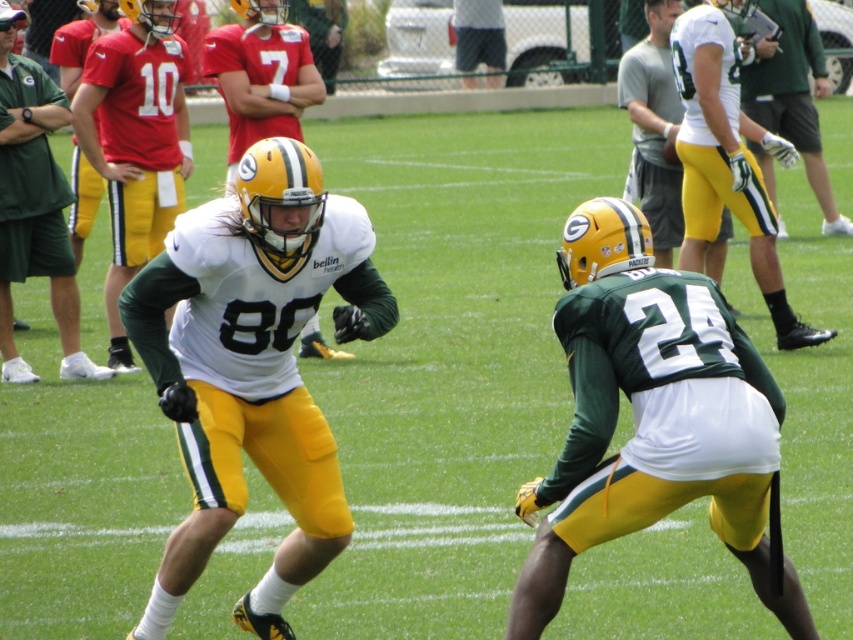
Can you confirm if matte green helmet at left is positioned to the left of green matte helmet at upper right?

Yes, matte green helmet at left is to the left of green matte helmet at upper right.

Consider the image. Which is more to the right, matte green helmet at left or green matte helmet at upper right?

From the viewer's perspective, green matte helmet at upper right appears more on the right side.

Identify the location of matte green helmet at left. The width and height of the screenshot is (853, 640). (33, 205).

Where is `matte green helmet at left`? matte green helmet at left is located at coordinates (33, 205).

Is green matte jersey at center below matte green helmet at left?

Indeed, green matte jersey at center is positioned under matte green helmet at left.

Between green matte jersey at center and matte green helmet at left, which one has less height?

With less height is green matte jersey at center.

You are a GUI agent. You are given a task and a screenshot of the screen. Output one action in this format:
    pyautogui.click(x=<x>, y=<y>)
    Task: Click on the green matte jersey at center
    This screenshot has height=640, width=853.
    Given the screenshot: What is the action you would take?
    pyautogui.click(x=653, y=417)

Who is positioned more to the left, green matte jersey at center or green matte helmet at upper right?

Positioned to the left is green matte jersey at center.

Looking at this image, is green matte jersey at center wider than green matte helmet at upper right?

No, green matte jersey at center is not wider than green matte helmet at upper right.

Locate an element on the screen. Image resolution: width=853 pixels, height=640 pixels. green matte jersey at center is located at coordinates (653, 417).